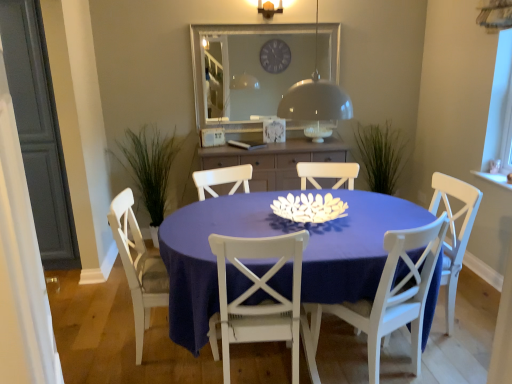
Question: Looking at their shapes, would you say white painted wood chair at center, the 3th chair in the right-to-left sequence, is wider or thinner than matte blue table at center?

Choices:
 (A) thin
 (B) wide

Answer: (A)

Question: Based on their positions, is white painted wood chair at center, the 3th chair in the right-to-left sequence, located to the left or right of matte blue table at center?

Choices:
 (A) right
 (B) left

Answer: (B)

Question: Based on their relative distances, which object is farther from the white glossy dome at upper center?

Choices:
 (A) matte blue table at center
 (B) white wood chair at center, placed as the 3th chair when sorted from left to right
 (C) white wood chair at center, which appears as the 4th chair when viewed from the left
 (D) white wood chair at center, the 4th chair viewed from the right
 (E) matte wood cabinet at center

Answer: (E)

Question: Which object is the farthest from the white matte flower at center?

Choices:
 (A) matte blue table at center
 (B) green grass at left
 (C) white painted wood chair at center, the 3th chair in the right-to-left sequence
 (D) white wood chair at center, the 2th chair when ordered from right to left
 (E) matte wood cabinet at center

Answer: (B)